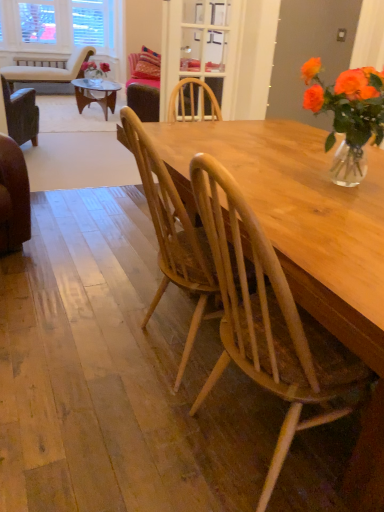
Question: Is translucent glass vase at upper right situated inside beige fabric chair at upper left, which ranks as the first chair in top-to-bottom order, or outside?

Choices:
 (A) inside
 (B) outside

Answer: (B)

Question: Relative to beige fabric chair at upper left, the first chair from the left, is translucent glass vase at upper right in front or behind?

Choices:
 (A) front
 (B) behind

Answer: (A)

Question: Estimate the real-world distances between objects in this image. Which object is closer to the clear glass door at upper center?

Choices:
 (A) beige fabric chair at upper left, the third chair ordered from the bottom
 (B) light brown wood chair at center, which appears as the second chair when viewed from the left
 (C) translucent glass vase at upper right
 (D) natural wood chair at center, which appears as the 3th chair when viewed from the back

Answer: (A)

Question: Based on their relative distances, which object is farther from the beige fabric chair at upper left, the 1th chair viewed from the back?

Choices:
 (A) clear glass door at upper center
 (B) light brown wood chair at center, which appears as the 2th chair when ordered from the bottom
 (C) natural wood chair at center, which appears as the 1th chair when viewed from the right
 (D) translucent glass vase at upper right

Answer: (C)